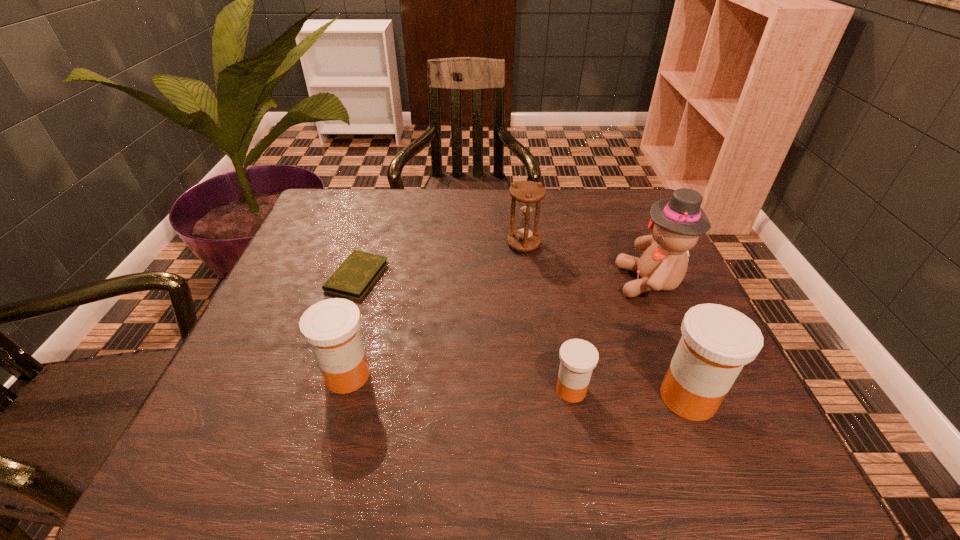
Locate an element on the screen. free space located on the label of the rightmost medicine is located at coordinates (571, 397).

Image resolution: width=960 pixels, height=540 pixels. I want to click on vacant area located 0.160m on the label of the rightmost medicine, so click(565, 397).

Find the location of a particular element. Image resolution: width=960 pixels, height=540 pixels. vacant region located on the label of the rightmost medicine is located at coordinates (588, 397).

The height and width of the screenshot is (540, 960). I want to click on free space located 0.320m on the left of the hourglass, so click(379, 244).

I want to click on vacant space located 0.120m on the front-facing side of the rag_doll, so click(x=564, y=281).

Where is `vacant space located on the front-facing side of the rag_doll`? The height and width of the screenshot is (540, 960). vacant space located on the front-facing side of the rag_doll is located at coordinates (560, 281).

Locate an element on the screen. This screenshot has height=540, width=960. vacant region located on the front-facing side of the rag_doll is located at coordinates (524, 281).

Identify the location of free space located 0.200m on the back of the shortest object. (378, 211).

Where is `object that is positioned at the far edge`? This screenshot has width=960, height=540. object that is positioned at the far edge is located at coordinates (528, 194).

At what (x,y) coordinates should I click in order to perform the action: click on object at the left edge. Please return your answer as a coordinate pair (x, y). Looking at the image, I should click on (354, 277).